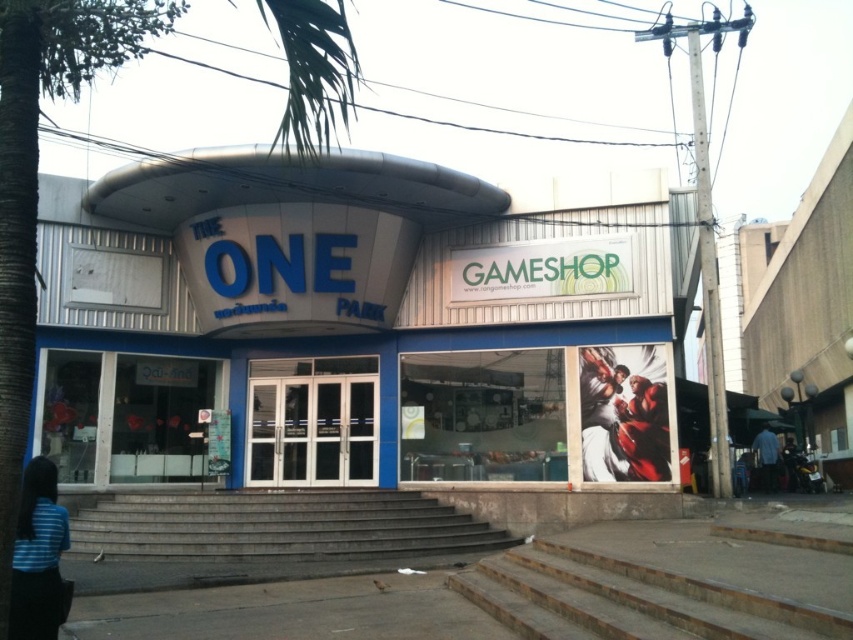
You are standing in front of THE ONE PARK building and want to take a photo. You notice two points marked on the building facade at coordinates point (51,83) and point (624,369). Which point will appear larger in your photo?

Point (51,83) will appear larger in the photo because it is closer to the camera than point (624,369).